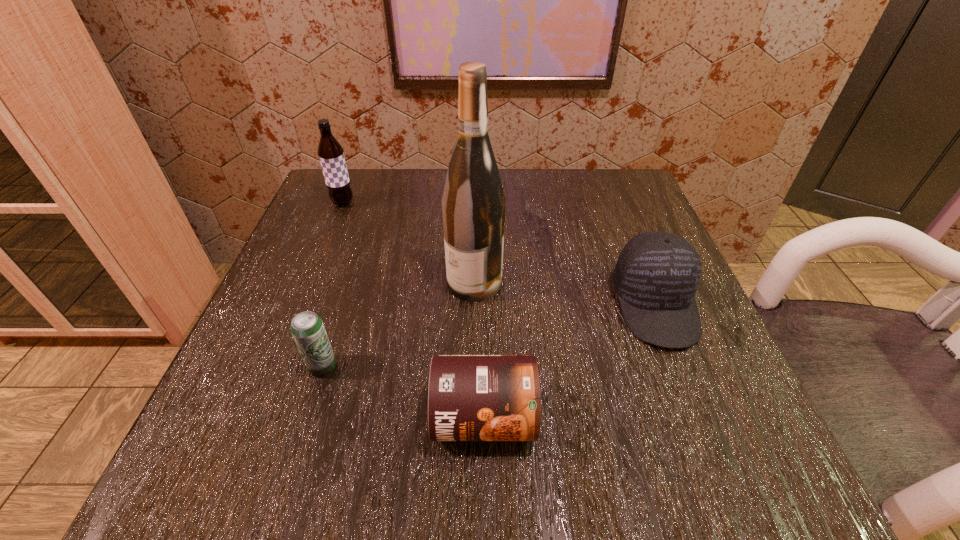
Image resolution: width=960 pixels, height=540 pixels. What are the coordinates of `vacant space at the far left corner of the desktop` in the screenshot? It's located at (315, 217).

Locate an element on the screen. vacant space at the near left corner is located at coordinates (293, 473).

Identify the location of vacant area at the far right corner. This screenshot has height=540, width=960. (640, 214).

Image resolution: width=960 pixels, height=540 pixels. I want to click on vacant space that's between the wine bottle and the can, so click(x=479, y=350).

This screenshot has width=960, height=540. I want to click on vacant space that is in between the second tallest object and the nearest object, so click(413, 310).

Locate an element on the screen. This screenshot has height=540, width=960. empty space between the rightmost object and the tallest object is located at coordinates pos(564,294).

I want to click on free space between the second nearest object and the tallest object, so click(398, 325).

The width and height of the screenshot is (960, 540). What are the coordinates of `vacant space in between the second tallest object and the nearest object` in the screenshot? It's located at (413, 310).

Locate an element on the screen. This screenshot has height=540, width=960. unoccupied position between the second object from left to right and the leftmost object is located at coordinates (333, 285).

Where is `free space between the farthest object and the can`? free space between the farthest object and the can is located at coordinates (413, 310).